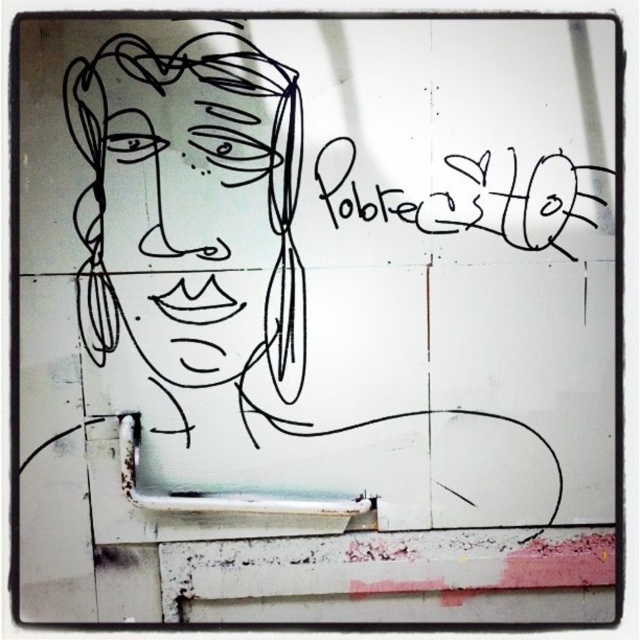
Between black line drawing face at upper left and black marker writing at upper right, which one has less height?

black marker writing at upper right

Measure the distance between black line drawing face at upper left and black marker writing at upper right.

black line drawing face at upper left is 15.29 inches from black marker writing at upper right.

Between point (262, 154) and point (448, 168), which one is positioned in front?

Point (262, 154) is more forward.

Where is `black line drawing face at upper left`? This screenshot has height=640, width=640. black line drawing face at upper left is located at coordinates [189, 166].